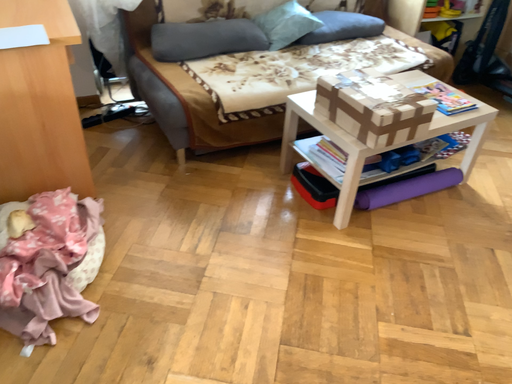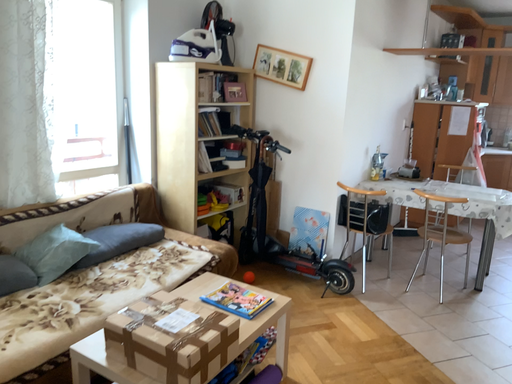
Question: Which way did the camera rotate in the video?

Choices:
 (A) rotated downward
 (B) rotated upward

Answer: (B)